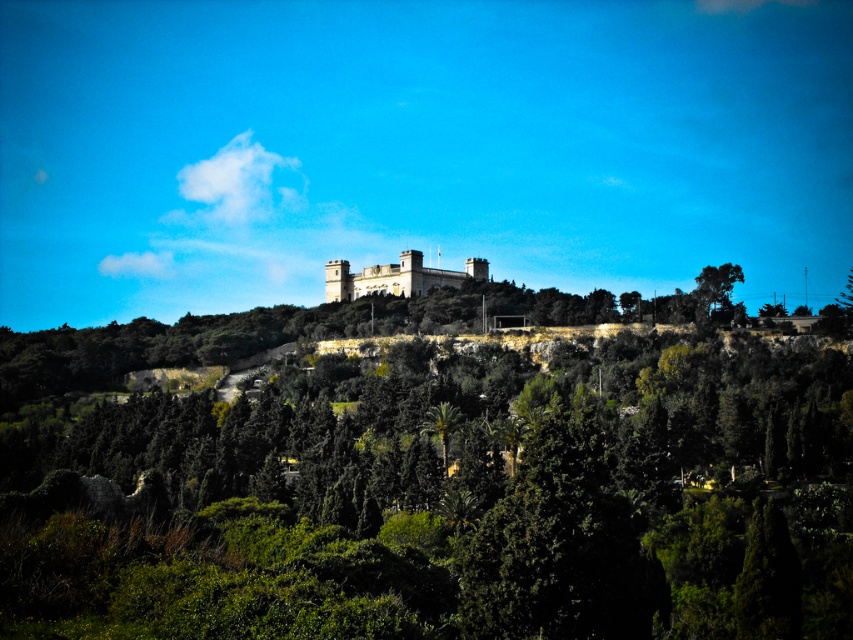
You are an architect analyzing the layout of the scene. You need to determine the spatial relationship between the stone castle at center and the green leafy tree at upper right. Which object is located to the left of the other?

The stone castle at center is positioned on the left side of green leafy tree at upper right.

You are an archer positioned at the base of the hill. You need to shoot an arrow towards the green leafy tree at upper right. Will the stone castle at center block your shot?

The green leafy tree at upper right is behind the stone castle at center, so the stone castle at center will block your shot towards the green leafy tree at upper right.